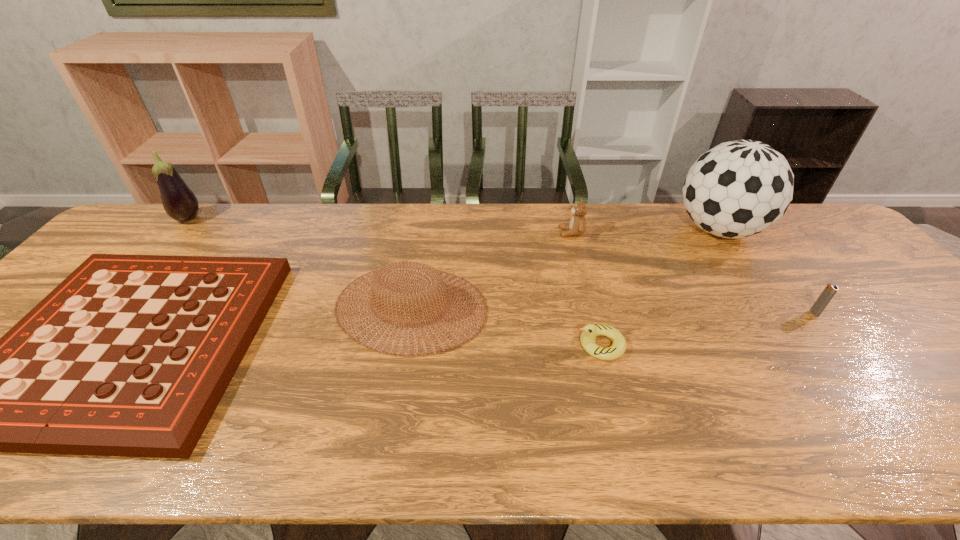
I want to click on vacant space that is in between the teddy bear and the soccer ball, so click(x=645, y=231).

Where is `free space that is in between the teddy bear and the sixth shortest object`? The width and height of the screenshot is (960, 540). free space that is in between the teddy bear and the sixth shortest object is located at coordinates click(380, 226).

The image size is (960, 540). Identify the location of object that is the sixth closest one to the eggplant. (830, 290).

Where is `the sixth closest object to the teddy bear`? This screenshot has height=540, width=960. the sixth closest object to the teddy bear is located at coordinates (180, 203).

This screenshot has height=540, width=960. Identify the location of vacant point that satisfies the following two spatial constraints: 1. on the front side of the igniter; 2. on the right side of the sunhat. (410, 313).

Locate an element on the screen. free spot that satisfies the following two spatial constraints: 1. on the front-facing side of the teddy bear; 2. on the back side of the igniter is located at coordinates (592, 313).